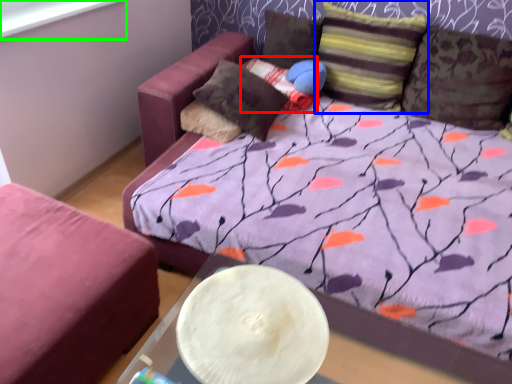
Question: Considering the real-world distances, which object is farthest from pillow (highlighted by a red box)? pillow (highlighted by a blue box) or window screen (highlighted by a green box)?

Choices:
 (A) pillow
 (B) window screen

Answer: (B)